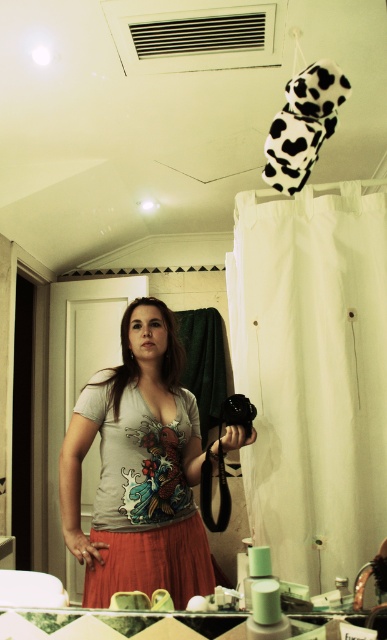
Between matte cotton dress at center and black plastic camera at lower center, which one is positioned lower?

matte cotton dress at center is below.

Is matte cotton dress at center taller than black plastic camera at lower center?

Indeed, matte cotton dress at center has a greater height compared to black plastic camera at lower center.

Locate an element on the screen. matte cotton dress at center is located at coordinates (143, 499).

Locate an element on the screen. This screenshot has width=387, height=640. matte cotton dress at center is located at coordinates (143, 499).